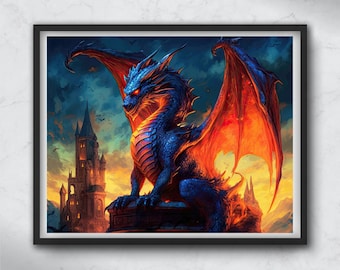
Where is `wall`? Image resolution: width=340 pixels, height=270 pixels. wall is located at coordinates (20, 248).